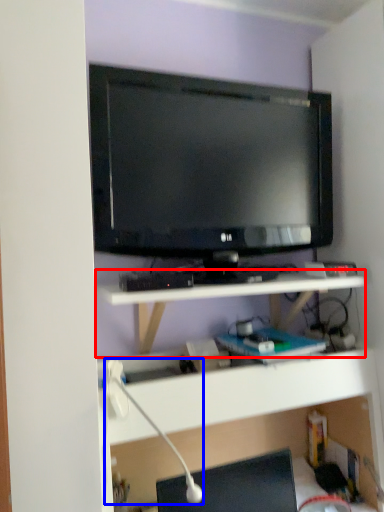
Question: Which point is further to the camera, shelf (highlighted by a red box) or lamp (highlighted by a blue box)?

Choices:
 (A) shelf
 (B) lamp

Answer: (A)